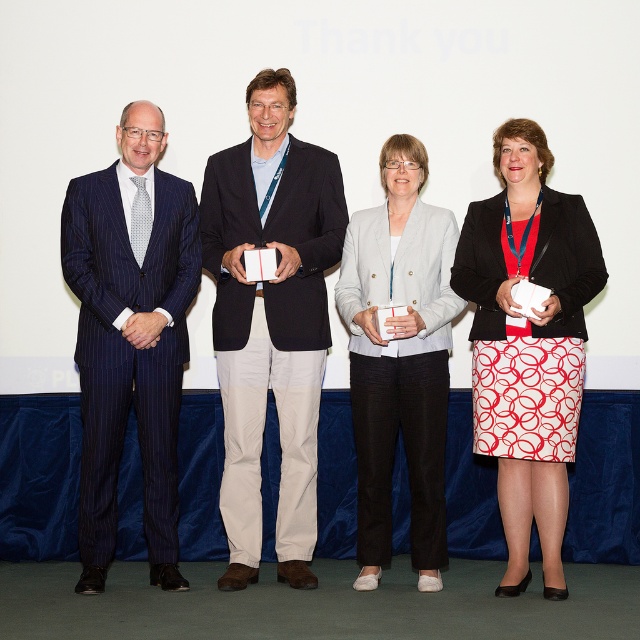
You are organizing a photo shoot and need to arrange the matte black suit at center and the light gray blazer at center in a way that accounts for their sizes. Which one should be placed in a position that requires more space to accommodate its size?

The matte black suit at center is larger in size than the light gray blazer at center, so it should be placed in the position that requires more space to accommodate its size.

You are organizing a group photo and need to ensure that the blue pinstripe suit at left and the white printed skirt at center are visible. Given their widths, which of the two requires more space between them to avoid overlapping?

The white printed skirt at center requires more space between them because it is wider than the blue pinstripe suit at left.

Based on the photo, you are a photographer standing 1.5 meters away from the two central figures, the matte black suit at center and the light gray blazer at center. You want to take a photo that captures both of them clearly in the frame. Considering the distance between them, will you need to adjust your camera to a wider angle to ensure both are fully visible?

The matte black suit at center is 49.08 centimeters away from the light gray blazer at center. Since the distance between them is less than 1.5 meters, a standard camera angle should suffice to capture both figures without needing a wider angle.